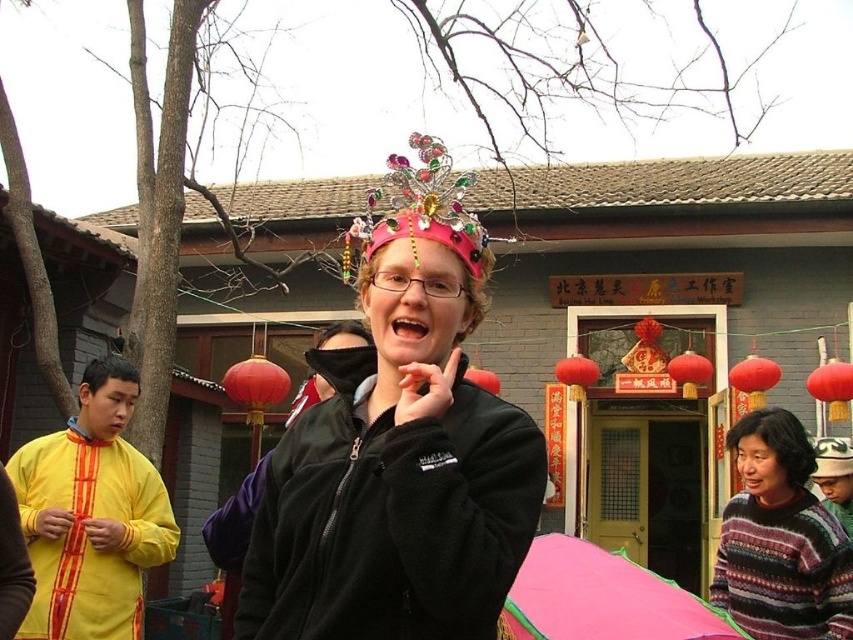
You are standing at a point in the scene and want to move towards the entrance of the traditional building. There are two points marked in the image, point (74, 492) and point (247, 369). Which point should you move towards to reach the entrance first?

Point (74, 492) is in front of point (247, 369), so you should move towards point (74, 492) to reach the entrance first.

You are standing in the festive outdoor scene and want to walk towards both the point at coordinates point (793, 486) and the point at coordinates point (103, 397). Which point will you reach first?

You will reach point (793, 486) first because it is closer to you than point (103, 397).

You are standing in front of the traditional building and see the matte black sweater at lower right and the yellow fabric head at left. Which object is positioned to the right side?

The matte black sweater at lower right is positioned to the right of the yellow fabric head at left.